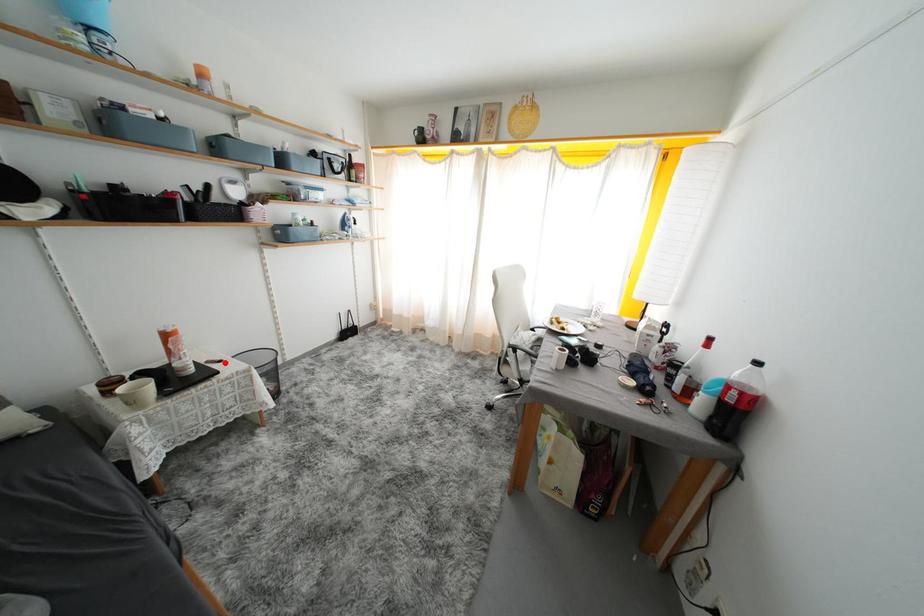
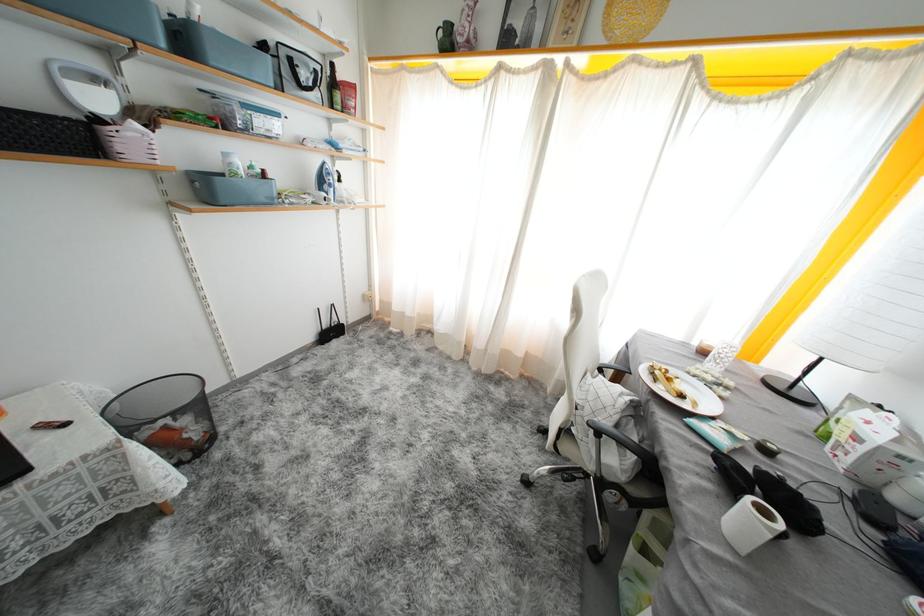
Question: I am providing you with two images of the same scene from different viewpoints. Image1 has a red point marked. In image2, the corresponding 3D location appears at what relative position? Reply with the corresponding letter.

Choices:
 (A) Closer
 (B) Farther

Answer: (B)